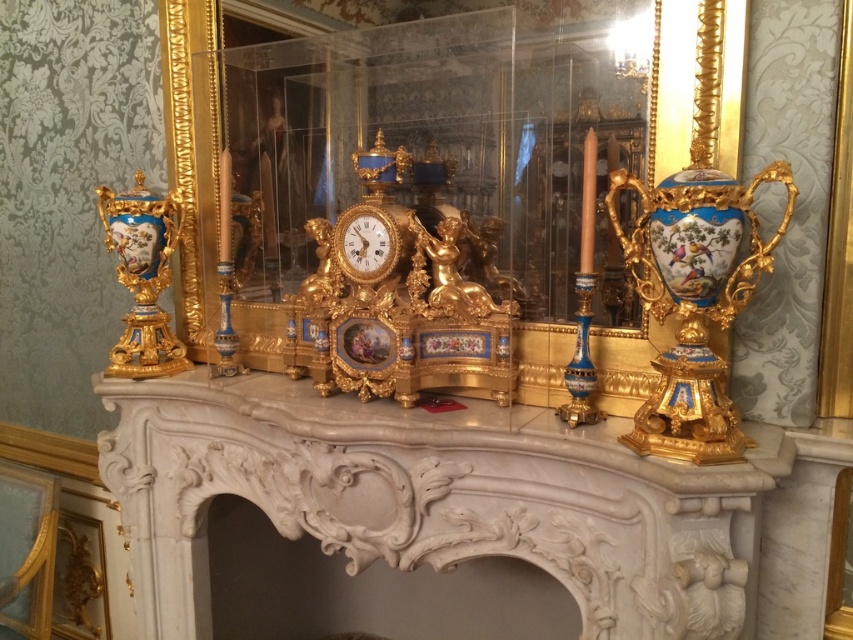
Question: Can you confirm if porcelain blue vase at left is positioned to the left of gold/ornate clock at center?

Choices:
 (A) no
 (B) yes

Answer: (B)

Question: Which point is closer to the camera taking this photo?

Choices:
 (A) (123, 320)
 (B) (306, 513)
 (C) (352, 262)
 (D) (466, 92)

Answer: (D)

Question: Which point is farther to the camera?

Choices:
 (A) porcelain blue vase at left
 (B) gold/gilded mirror at center

Answer: (A)

Question: Which of the following is the farthest from the observer?

Choices:
 (A) porcelain blue vase at right
 (B) gold/gilded mirror at center
 (C) gold/ornate clock at center

Answer: (C)

Question: Does white marble fireplace at center have a larger size compared to gold/ornate clock at center?

Choices:
 (A) yes
 (B) no

Answer: (A)

Question: Where is gold/gilded mirror at center located in relation to porcelain blue vase at right in the image?

Choices:
 (A) left
 (B) right

Answer: (A)